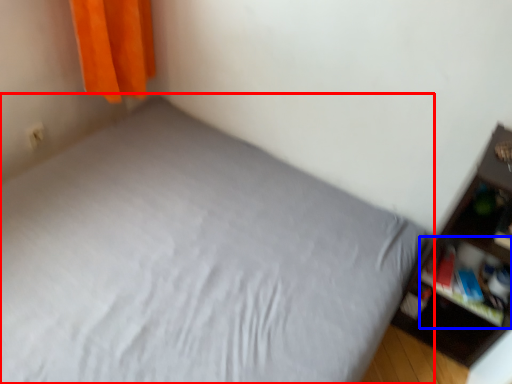
Question: Which object appears closest to the camera in this image, bed (highlighted by a red box) or cabinet (highlighted by a blue box)?

Choices:
 (A) bed
 (B) cabinet

Answer: (A)